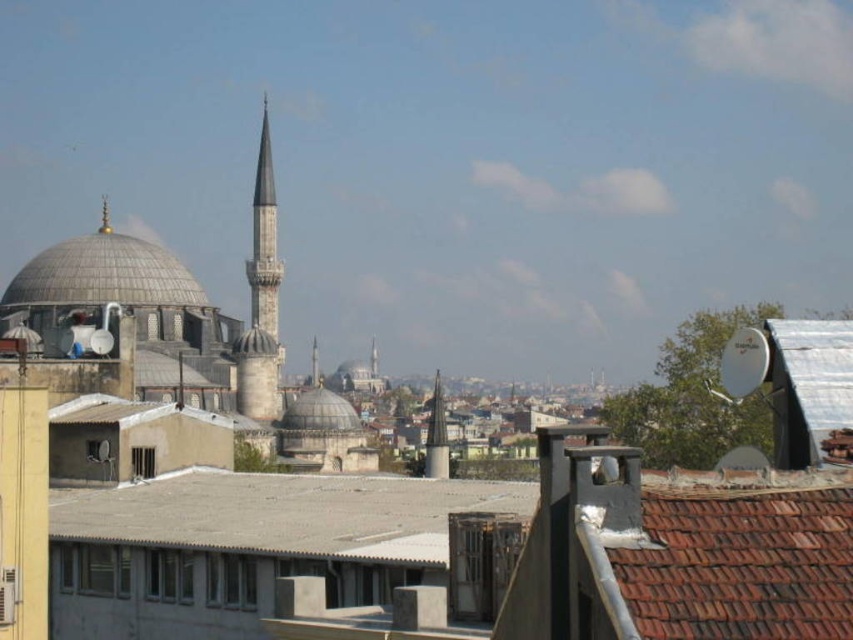
Does gray concrete roof at center have a greater height compared to smooth silver spire at center?

No, gray concrete roof at center is not taller than smooth silver spire at center.

Is point (281, 508) closer to viewer compared to point (427, 449)?

Yes, it is.

Is point (293, 528) in front of point (427, 435)?

Yes, it is in front of point (427, 435).

The image size is (853, 640). I want to click on gray concrete roof at center, so click(x=285, y=513).

Is smooth silver spire at center below smooth gray minaret at center?

Correct, smooth silver spire at center is located below smooth gray minaret at center.

Is point (433, 420) closer to viewer compared to point (315, 342)?

Yes.

Is point (430, 451) in front of point (310, 369)?

Yes, it is in front of point (310, 369).

You are a GUI agent. You are given a task and a screenshot of the screen. Output one action in this format:
    pyautogui.click(x=<x>, y=<y>)
    Task: Click on the smooth silver spire at center
    The image size is (853, 640).
    Given the screenshot: What is the action you would take?
    pyautogui.click(x=436, y=435)

Is gray stone minaret at center to the right of smooth silver spire at center from the viewer's perspective?

Incorrect, gray stone minaret at center is not on the right side of smooth silver spire at center.

Consider the image. Does gray stone minaret at center have a greater width compared to smooth silver spire at center?

Indeed, gray stone minaret at center has a greater width compared to smooth silver spire at center.

The image size is (853, 640). What do you see at coordinates (260, 298) in the screenshot?
I see `gray stone minaret at center` at bounding box center [260, 298].

At what (x,y) coordinates should I click in order to perform the action: click on gray stone minaret at center. Please return your answer as a coordinate pair (x, y). Looking at the image, I should click on (260, 298).